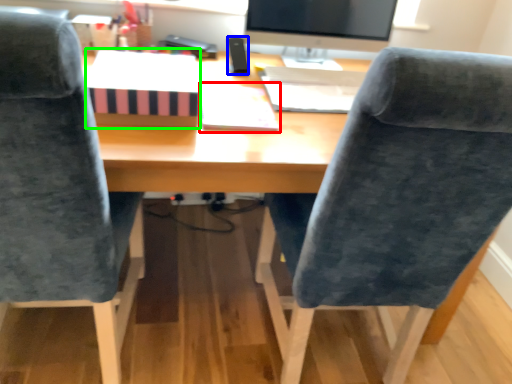
Question: Which object is the closest to the notebook (highlighted by a red box)? Choose among these: stationery (highlighted by a blue box) or book (highlighted by a green box).

Choices:
 (A) stationery
 (B) book

Answer: (B)